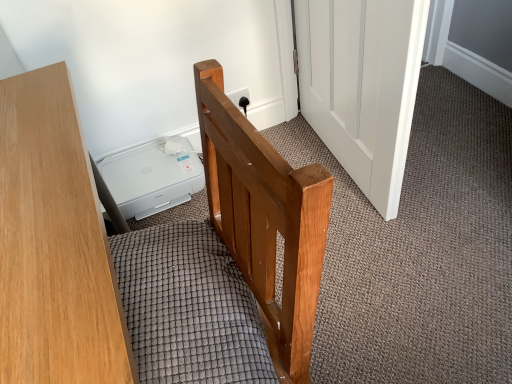
The image size is (512, 384). Find the location of `free space in front of white wooden door at center`. free space in front of white wooden door at center is located at coordinates [404, 255].